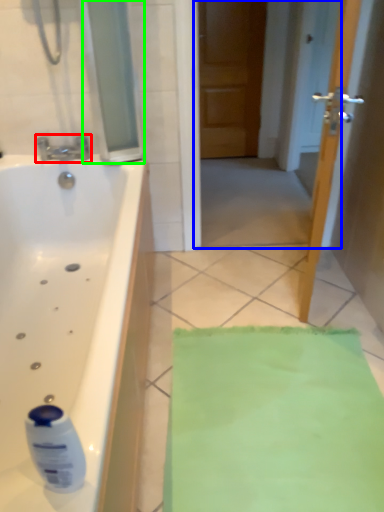
Question: Which object is the farthest from tap (highlighted by a red box)? Choose among these: screen door (highlighted by a blue box) or glass door (highlighted by a green box).

Choices:
 (A) screen door
 (B) glass door

Answer: (A)